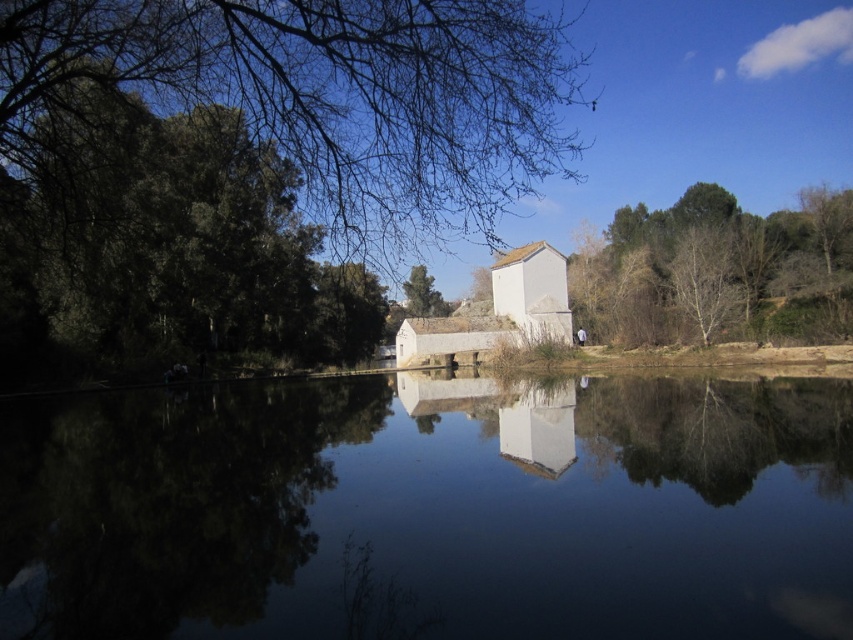
Question: Which object is the closest to the green leafy tree at upper left?

Choices:
 (A) green leafy tree at right
 (B) transparent water at center

Answer: (B)

Question: Is transparent water at center below green leafy tree at right?

Choices:
 (A) yes
 (B) no

Answer: (A)

Question: Can you confirm if green leafy tree at upper left is smaller than green leafy tree at right?

Choices:
 (A) no
 (B) yes

Answer: (A)

Question: Which of the following is the closest to the observer?

Choices:
 (A) green leafy tree at upper left
 (B) transparent water at center

Answer: (B)

Question: Does transparent water at center appear on the right side of green leafy tree at right?

Choices:
 (A) yes
 (B) no

Answer: (B)

Question: Which object is closer to the camera taking this photo?

Choices:
 (A) green leafy tree at upper left
 (B) transparent water at center

Answer: (B)